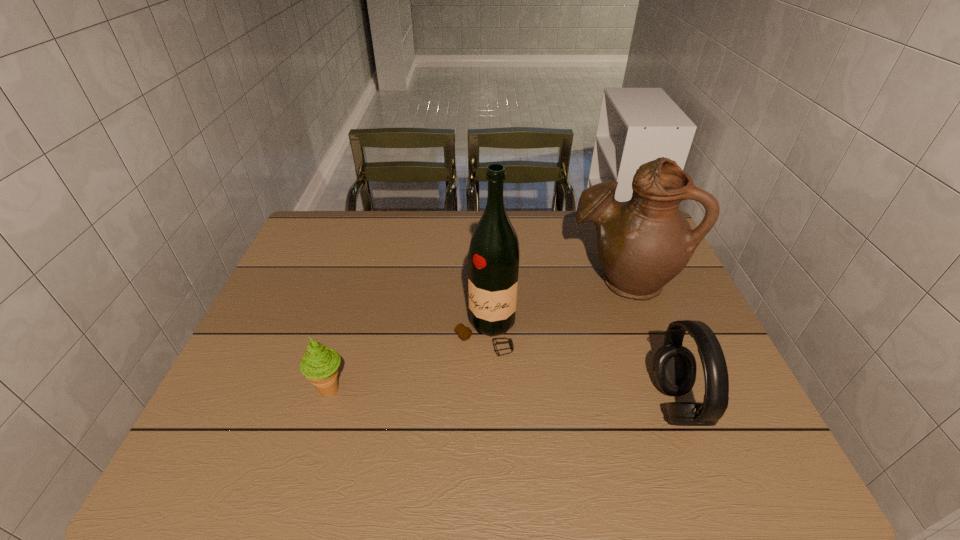
At what (x,y) coordinates should I click in order to perform the action: click on free spot located on the surface of the wine bottle. Please return your answer as a coordinate pair (x, y). Looking at the image, I should click on (463, 376).

You are a GUI agent. You are given a task and a screenshot of the screen. Output one action in this format:
    pyautogui.click(x=<x>, y=<y>)
    Task: Click on the vacant area located on the surface of the wine bottle
    This screenshot has height=540, width=960.
    Given the screenshot: What is the action you would take?
    pyautogui.click(x=459, y=383)

Locate an element on the screen. Image resolution: width=960 pixels, height=540 pixels. free space located 0.100m on the surface of the wine bottle is located at coordinates (455, 390).

This screenshot has height=540, width=960. What are the coordinates of `object present at the far edge` in the screenshot? It's located at [643, 243].

I want to click on icecream present at the near edge, so click(x=319, y=365).

Find the location of `headset located at the near edge`. headset located at the near edge is located at coordinates (674, 366).

The image size is (960, 540). I want to click on headset that is positioned at the right edge, so click(674, 366).

Where is `pitcher that is at the right edge`? Image resolution: width=960 pixels, height=540 pixels. pitcher that is at the right edge is located at coordinates (643, 243).

Identify the location of object located in the far right corner section of the desktop. Image resolution: width=960 pixels, height=540 pixels. (643, 243).

The image size is (960, 540). Identify the location of object present at the near right corner. (674, 366).